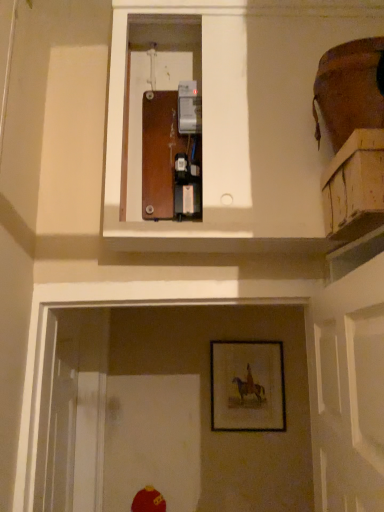
What do you see at coordinates (355, 186) in the screenshot?
I see `wooden crate at upper right` at bounding box center [355, 186].

You are a GUI agent. You are given a task and a screenshot of the screen. Output one action in this format:
    pyautogui.click(x=<x>, y=<y>)
    Task: Click on the wooden crate at upper right
    This screenshot has height=512, width=384.
    Given the screenshot: What is the action you would take?
    pyautogui.click(x=355, y=186)

Find the location of a particular element. The image size is (384, 512). wooden framed picture at lower center is located at coordinates (247, 386).

Describe the element at coordinates (247, 386) in the screenshot. The image size is (384, 512). I see `wooden framed picture at lower center` at that location.

Locate an element on the screen. wooden crate at upper right is located at coordinates (355, 186).

Does wooden crate at upper right appear on the right side of wooden framed picture at lower center?

Correct, you'll find wooden crate at upper right to the right of wooden framed picture at lower center.

Does wooden crate at upper right lie behind wooden framed picture at lower center?

That is False.

Which is nearer, (367, 146) or (255, 423)?

Point (367, 146) is closer to the camera than point (255, 423).

From the image's perspective, between wooden crate at upper right and wooden framed picture at lower center, which one is located above?

wooden crate at upper right, from the image's perspective.

From a real-world perspective, between wooden crate at upper right and wooden framed picture at lower center, who is vertically lower?

wooden framed picture at lower center, from a real-world perspective.

Which object is wider, wooden crate at upper right or wooden framed picture at lower center?

wooden crate at upper right.

Is wooden crate at upper right taller than wooden framed picture at lower center?

Incorrect, the height of wooden crate at upper right is not larger of that of wooden framed picture at lower center.

Considering the sizes of objects wooden crate at upper right and wooden framed picture at lower center in the image provided, who is bigger, wooden crate at upper right or wooden framed picture at lower center?

With larger size is wooden framed picture at lower center.

Is wooden crate at upper right positioned beyond the bounds of wooden framed picture at lower center?

Yes, wooden crate at upper right is outside of wooden framed picture at lower center.

Would you say wooden crate at upper right is a long distance from wooden framed picture at lower center?

wooden crate at upper right is positioned a significant distance from wooden framed picture at lower center.

Could you tell me if wooden crate at upper right is facing wooden framed picture at lower center?

No, wooden crate at upper right is not turned towards wooden framed picture at lower center.

What's the angular difference between wooden crate at upper right and wooden framed picture at lower center's facing directions?

The angular difference between wooden crate at upper right and wooden framed picture at lower center is 93.7 degrees.

At what (x,y) coordinates should I click in order to perform the action: click on picture frame below the wooden crate at upper right (from the image's perspective). Please return your answer as a coordinate pair (x, y). This screenshot has height=512, width=384. Looking at the image, I should click on (247, 386).

Is wooden framed picture at lower center to the right of wooden crate at upper right from the viewer's perspective?

No.

Looking at this image, which is behind, wooden framed picture at lower center or wooden crate at upper right?

Positioned behind is wooden framed picture at lower center.

Considering the positions of point (236, 402) and point (362, 181), is point (236, 402) closer or farther from the camera than point (362, 181)?

Point (236, 402).

From the image's perspective, is wooden framed picture at lower center positioned above or below wooden crate at upper right?

From the image's perspective, wooden framed picture at lower center appears below wooden crate at upper right.

From a real-world perspective, between wooden framed picture at lower center and wooden crate at upper right, who is vertically higher?

wooden crate at upper right, from a real-world perspective.

Considering the sizes of wooden framed picture at lower center and wooden crate at upper right in the image, is wooden framed picture at lower center wider or thinner than wooden crate at upper right?

wooden framed picture at lower center is thinner than wooden crate at upper right.

Which of these two, wooden framed picture at lower center or wooden crate at upper right, stands shorter?

wooden crate at upper right is shorter.

Considering the sizes of wooden framed picture at lower center and wooden crate at upper right in the image, is wooden framed picture at lower center bigger or smaller than wooden crate at upper right?

Considering their sizes, wooden framed picture at lower center takes up more space than wooden crate at upper right.

Is wooden framed picture at lower center not inside wooden crate at upper right?

wooden framed picture at lower center is positioned outside wooden crate at upper right.

Is wooden framed picture at lower center far away from wooden crate at upper right?

Yes, wooden framed picture at lower center and wooden crate at upper right are located far from each other.

Is wooden framed picture at lower center looking in the opposite direction of wooden crate at upper right?

No.

Measure the distance from wooden framed picture at lower center to wooden crate at upper right.

They are 1.65 meters apart.

Locate an element on the screen. This screenshot has width=384, height=512. cabinetry that appears above the wooden framed picture at lower center (from the image's perspective) is located at coordinates (355, 186).

At what (x,y) coordinates should I click in order to perform the action: click on cabinetry above the wooden framed picture at lower center (from the image's perspective). Please return your answer as a coordinate pair (x, y). Looking at the image, I should click on (355, 186).

What are the coordinates of `picture frame below the wooden crate at upper right (from a real-world perspective)` in the screenshot? It's located at (247, 386).